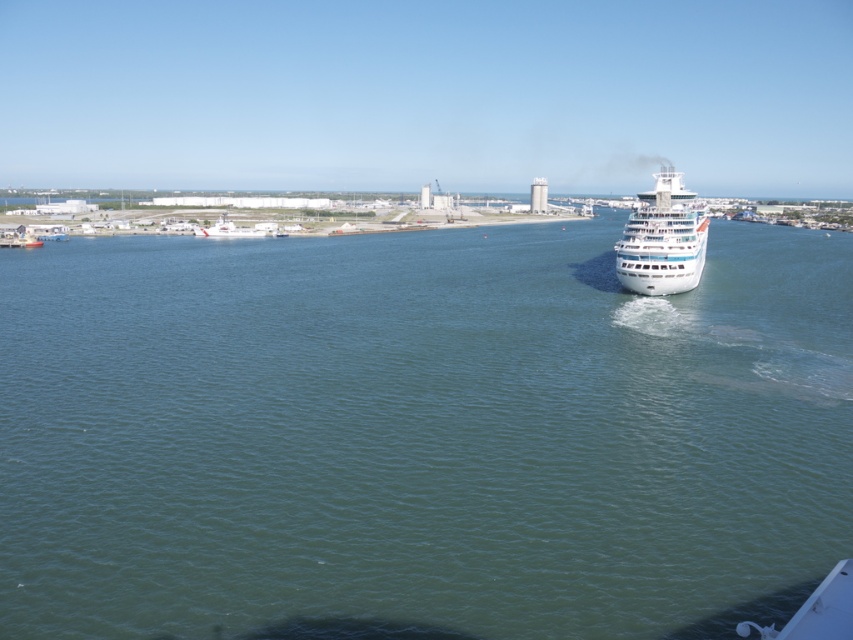
You are a drone operator trying to navigate between two points in the maritime scene. The first point is point (242,408) and the second point is point (643,250). Which point is closer to the cruise ship?

Point (242,408) is closer to the cruise ship because it is in front of point (643,250), which is further away.

You are standing on the deck of the cruise ship positioned on the right side of the image. You want to locate the green water at center. In which direction should you look relative to your position?

You should look towards the center of the image, which is the green water at center located at point coordinates (421, 435). Since the ship is on the right side, the center would be to your left.

You are a photographer trying to capture the white glossy cruise ship at center from the green water at center. Which object is closer to your camera lens?

The green water at center is in front of the white glossy cruise ship at center, so the green water at center is closer to the camera lens.